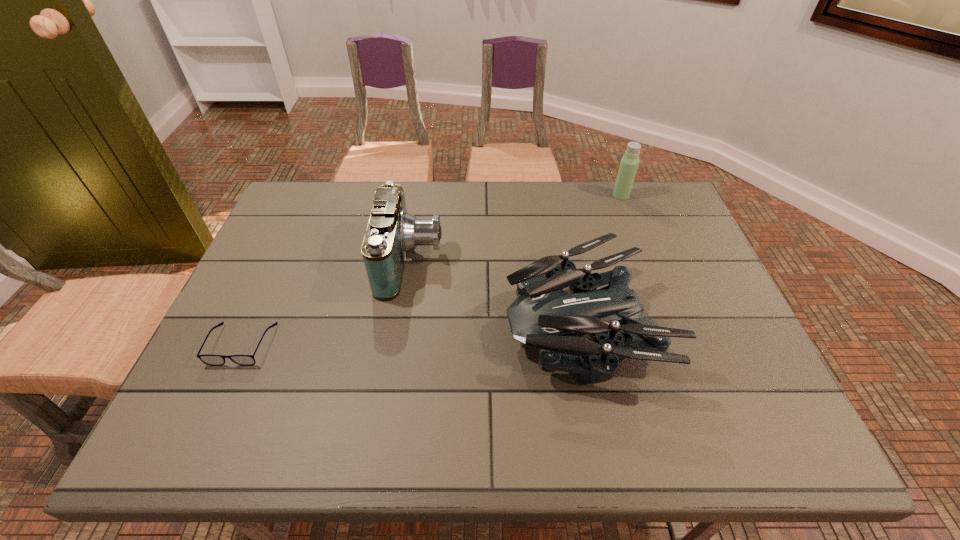
Where is `camcorder at the far edge`? The image size is (960, 540). camcorder at the far edge is located at coordinates (392, 232).

Find the location of `object situated at the left edge`. object situated at the left edge is located at coordinates (214, 360).

I want to click on object located at the right edge, so click(629, 163).

Locate an element on the screen. The width and height of the screenshot is (960, 540). object at the far right corner is located at coordinates (629, 163).

The height and width of the screenshot is (540, 960). I want to click on vacant space at the far edge of the desktop, so click(x=507, y=217).

Locate an element on the screen. The image size is (960, 540). vacant space at the near edge of the desktop is located at coordinates (478, 433).

At what (x,y) coordinates should I click in order to perform the action: click on vacant space at the left edge of the desktop. Please return your answer as a coordinate pair (x, y). This screenshot has width=960, height=540. Looking at the image, I should click on (301, 256).

In the image, there is a desktop. Identify the location of vacant space at the right edge. This screenshot has height=540, width=960. (668, 239).

The image size is (960, 540). In order to click on free region at the far left corner of the desktop in this screenshot , I will do `click(296, 212)`.

In order to click on free space that is in between the third object from right to left and the thermos bottle in this screenshot , I will do `click(516, 228)`.